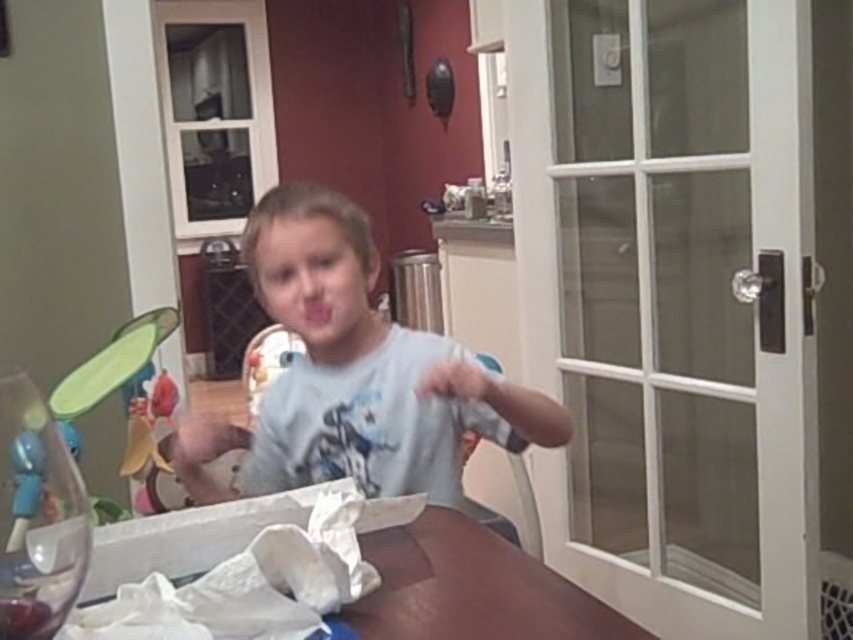
Question: Considering the real-world distances, which object is closest to the wooden table at lower center?

Choices:
 (A) transparent plastic wine glass at lower left
 (B) white cotton shirt at center
 (C) white glass screen door at right
 (D) pink matte mouth at center

Answer: (B)

Question: Can you confirm if white cotton shirt at center is positioned to the left of transparent plastic wine glass at lower left?

Choices:
 (A) no
 (B) yes

Answer: (A)

Question: Which object is closer to the camera taking this photo?

Choices:
 (A) pink matte mouth at center
 (B) white glass screen door at right
 (C) white cotton shirt at center

Answer: (C)

Question: Can you confirm if transparent plastic wine glass at lower left is thinner than pink matte mouth at center?

Choices:
 (A) yes
 (B) no

Answer: (B)

Question: Which of these objects is positioned farthest from the pink matte mouth at center?

Choices:
 (A) wooden table at lower center
 (B) white glass screen door at right
 (C) transparent plastic wine glass at lower left
 (D) white cotton shirt at center

Answer: (B)

Question: Is white glass screen door at right below wooden table at lower center?

Choices:
 (A) no
 (B) yes

Answer: (A)